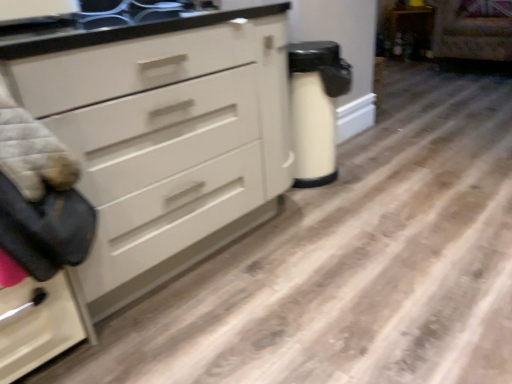
Question: Does velvet-like beige armchair at upper right come in front of white matte chest of drawers at center?

Choices:
 (A) yes
 (B) no

Answer: (B)

Question: Is velvet-like beige armchair at upper right next to white matte chest of drawers at center and touching it?

Choices:
 (A) no
 (B) yes

Answer: (A)

Question: Does velvet-like beige armchair at upper right appear on the right side of white matte chest of drawers at center?

Choices:
 (A) no
 (B) yes

Answer: (B)

Question: From the image's perspective, is velvet-like beige armchair at upper right located beneath white matte chest of drawers at center?

Choices:
 (A) no
 (B) yes

Answer: (A)

Question: Does velvet-like beige armchair at upper right appear on the left side of white matte chest of drawers at center?

Choices:
 (A) no
 (B) yes

Answer: (A)

Question: In the image, is wooden cabinet at upper right positioned in front of or behind velvet-like beige armchair at upper right?

Choices:
 (A) behind
 (B) front

Answer: (A)

Question: From a real-world perspective, is wooden cabinet at upper right positioned above or below velvet-like beige armchair at upper right?

Choices:
 (A) below
 (B) above

Answer: (A)

Question: Does point (414, 46) appear closer or farther from the camera than point (492, 24)?

Choices:
 (A) closer
 (B) farther

Answer: (B)

Question: In terms of height, does wooden cabinet at upper right look taller or shorter compared to velvet-like beige armchair at upper right?

Choices:
 (A) tall
 (B) short

Answer: (B)

Question: From a real-world perspective, is velvet-like beige armchair at upper right physically located above or below wooden cabinet at upper right?

Choices:
 (A) above
 (B) below

Answer: (A)

Question: From the image's perspective, relative to wooden cabinet at upper right, is velvet-like beige armchair at upper right above or below?

Choices:
 (A) below
 (B) above

Answer: (A)

Question: In terms of height, does velvet-like beige armchair at upper right look taller or shorter compared to wooden cabinet at upper right?

Choices:
 (A) short
 (B) tall

Answer: (B)

Question: Is velvet-like beige armchair at upper right to the left or to the right of wooden cabinet at upper right in the image?

Choices:
 (A) right
 (B) left

Answer: (A)

Question: Based on their positions, is white matte chest of drawers at center located to the left or right of wooden cabinet at upper right?

Choices:
 (A) right
 (B) left

Answer: (B)

Question: Considering the positions of white matte chest of drawers at center and wooden cabinet at upper right in the image, is white matte chest of drawers at center wider or thinner than wooden cabinet at upper right?

Choices:
 (A) thin
 (B) wide

Answer: (B)